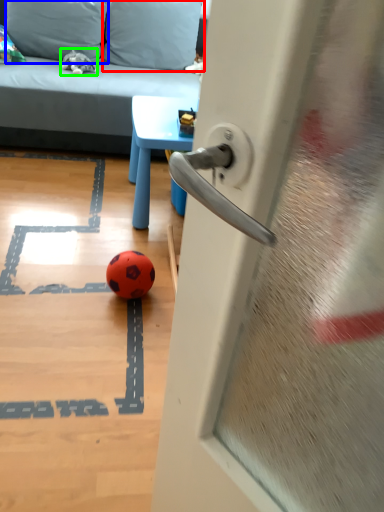
Question: Which is nearer to the pillow (highlighted by a red box)? pillow (highlighted by a blue box) or miniature (highlighted by a green box).

Choices:
 (A) pillow
 (B) miniature

Answer: (A)